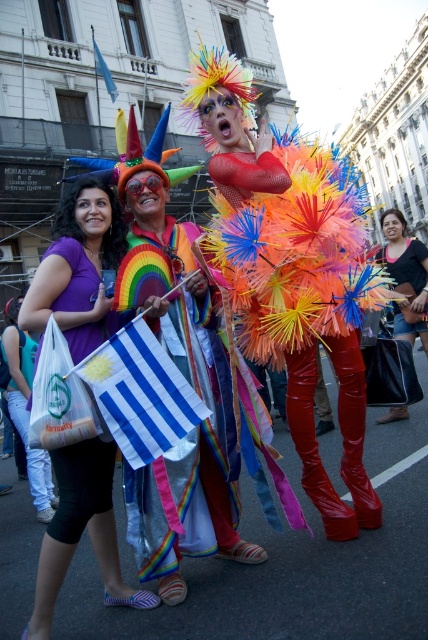
Question: Which object is farther from the camera taking this photo?

Choices:
 (A) purple fabric bag at center
 (B) bluestriped fabricflag at center

Answer: (B)

Question: Among these objects, which one is nearest to the camera?

Choices:
 (A) purple matte shirt at center
 (B) glossy red boots at center

Answer: (A)

Question: Does rainbow fabric flag at center appear on the left side of purple fabric bag at center?

Choices:
 (A) yes
 (B) no

Answer: (B)

Question: Which object is the closest to the purple matte shirt at center?

Choices:
 (A) matte black bag at center
 (B) blue fabric flag at upper left
 (C) white plastic bag at lower left
 (D) rainbow fabric flag at center

Answer: (C)

Question: Is purple matte shirt at center to the right of purple fabric bag at center from the viewer's perspective?

Choices:
 (A) no
 (B) yes

Answer: (B)

Question: Can you confirm if glossy red boots at center is bigger than rainbow fabric flag at center?

Choices:
 (A) yes
 (B) no

Answer: (A)